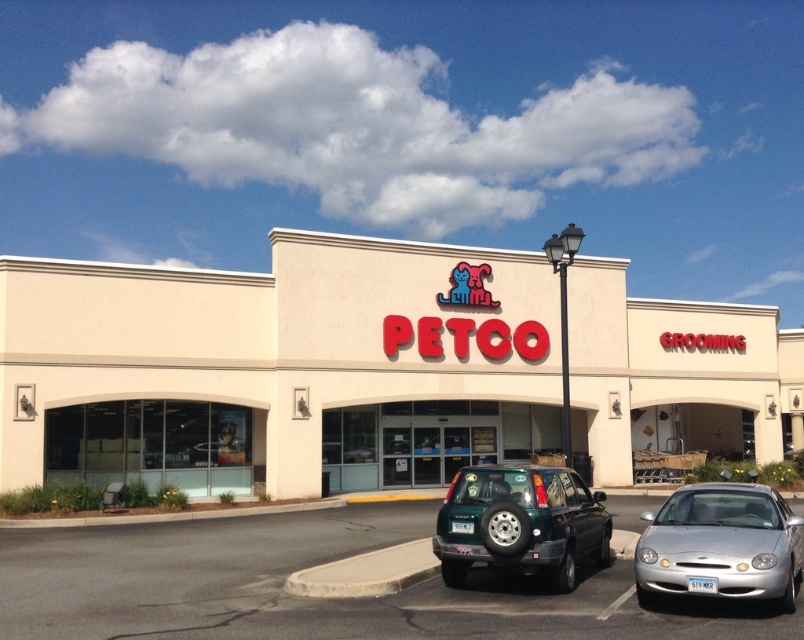
Based on the photo, measure the distance from beige/smooth building at center to silver metallic car at lower right.

beige/smooth building at center is 17.27 meters from silver metallic car at lower right.

Which of these two, beige/smooth building at center or silver metallic car at lower right, stands taller?

Standing taller between the two is beige/smooth building at center.

Who is more forward, (368, 449) or (714, 500)?

Point (714, 500)

The height and width of the screenshot is (640, 804). I want to click on beige/smooth building at center, so click(277, 368).

Based on the photo, who is lower down, metallic gray car at center or green matte suv at center?

metallic gray car at center is lower down.

Does metallic gray car at center appear on the left side of green matte suv at center?

Yes, metallic gray car at center is to the left of green matte suv at center.

Which is behind, point (772, 634) or point (462, 548)?

Positioned behind is point (462, 548).

Find the location of a particular element. The image size is (804, 640). metallic gray car at center is located at coordinates (314, 598).

Can you confirm if metallic gray car at center is bigger than silver metallic car at lower right?

Yes, metallic gray car at center is bigger than silver metallic car at lower right.

Is point (684, 611) positioned in front of point (704, 564)?

That is False.

Find the location of `metallic gray car at center`. metallic gray car at center is located at coordinates [x=314, y=598].